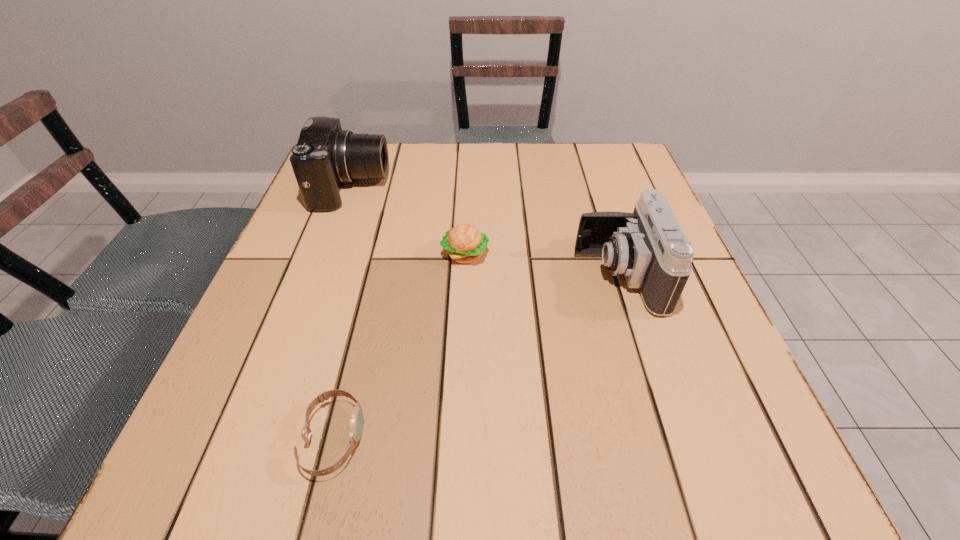
At what (x,y) coordinates should I click in order to perform the action: click on vacant space that satisfies the following two spatial constraints: 1. on the lens of the third tallest object; 2. on the left side of the farther camera. Please return your answer as a coordinate pair (x, y). Looking at the image, I should click on (326, 254).

Identify the location of vacant space that satisfies the following two spatial constraints: 1. on the lens of the farther camera; 2. on the right side of the second shortest object. (326, 254).

Locate an element on the screen. This screenshot has width=960, height=540. free spot that satisfies the following two spatial constraints: 1. on the lens of the third tallest object; 2. on the right side of the farther camera is located at coordinates (326, 254).